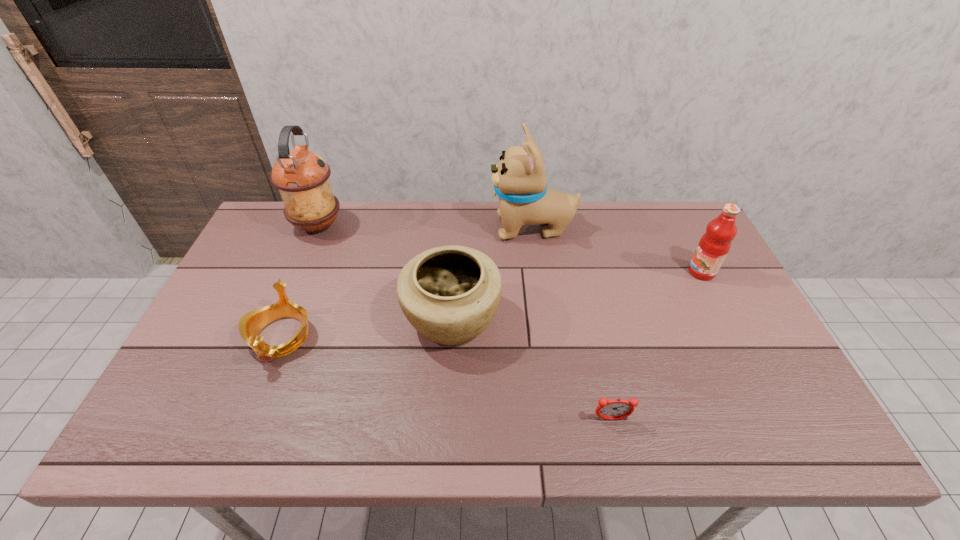
Locate an element on the screen. free area in between the puppy and the oil lamp is located at coordinates pos(425,227).

Where is `vacant space that is in between the nearest object and the tiara`? vacant space that is in between the nearest object and the tiara is located at coordinates (445, 379).

Image resolution: width=960 pixels, height=540 pixels. Identify the location of free space between the tiara and the third shortest object. (367, 328).

Locate an element on the screen. vacant area that lies between the tiara and the oil lamp is located at coordinates (299, 281).

The height and width of the screenshot is (540, 960). I want to click on empty space that is in between the tiara and the pottery, so click(x=367, y=328).

Identify the location of vacant area that lies between the fruit juice and the oil lamp. Image resolution: width=960 pixels, height=540 pixels. (510, 249).

This screenshot has height=540, width=960. What are the coordinates of `object that is the fourth closest to the puppy` in the screenshot? It's located at (250, 325).

Identify the location of the fifth closest object relative to the fourth tallest object. Image resolution: width=960 pixels, height=540 pixels. (714, 245).

Find the location of a particular element. The width and height of the screenshot is (960, 540). free point that satisfies the following two spatial constraints: 1. on the front label of the rightmost object; 2. at the front emblem of the second shortest object is located at coordinates (734, 337).

This screenshot has width=960, height=540. In order to click on vacant region that satisfies the following two spatial constraints: 1. on the front label of the third farthest object; 2. at the front emblem of the tiara in this screenshot , I will do `click(734, 337)`.